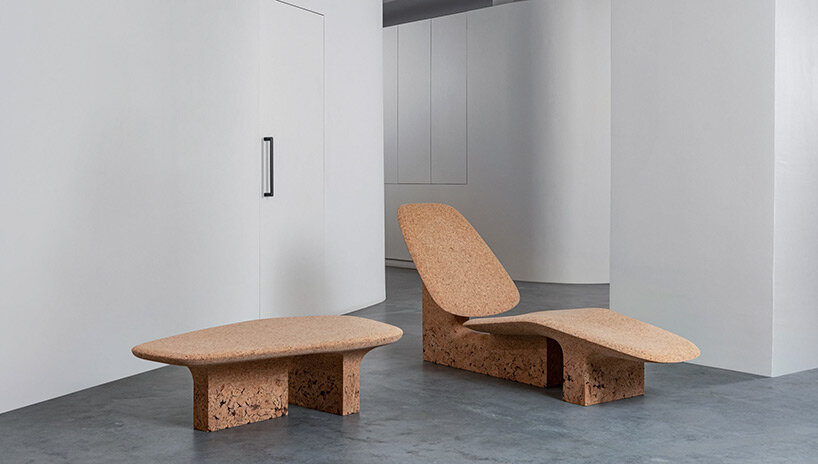
The image size is (818, 464). Identify the location of vertical panels in wall. (389, 100), (414, 97), (447, 98).